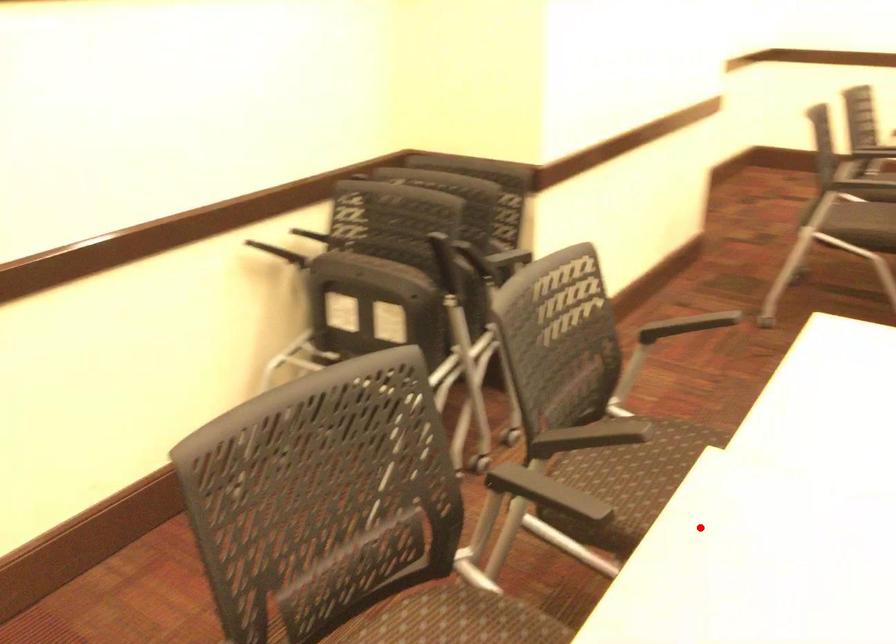
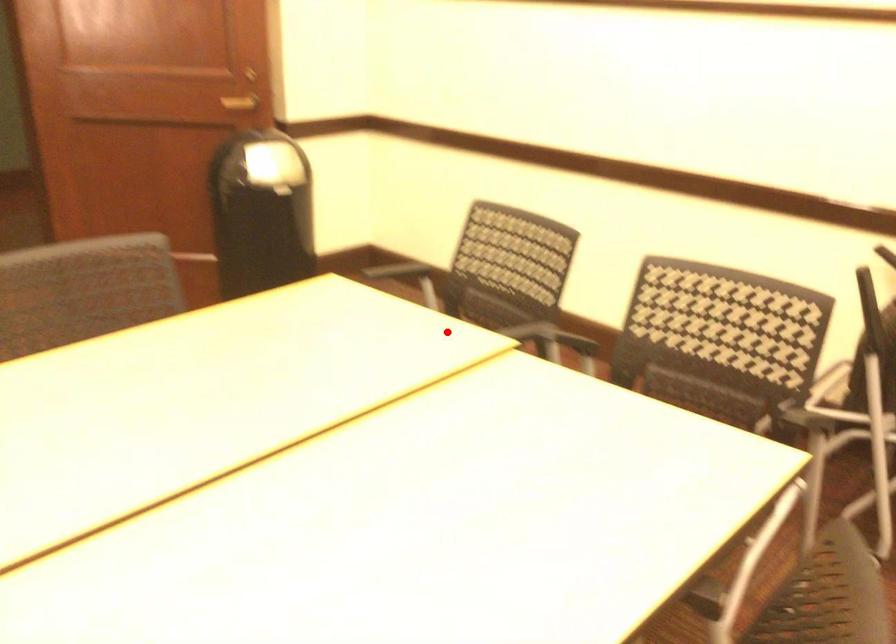
I am providing you with two images of the same scene from different viewpoints. A red point is marked on the first image and another point is marked on the second image. Does the point marked in image1 correspond to the same location as the one in image2?

Yes